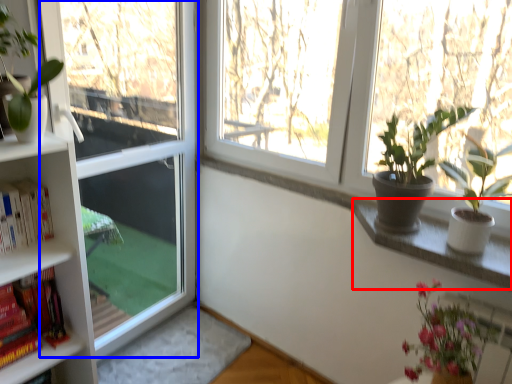
Question: Which of the following is the closest to the observer, window sill (highlighted by a red box) or screen door (highlighted by a blue box)?

Choices:
 (A) window sill
 (B) screen door

Answer: (A)